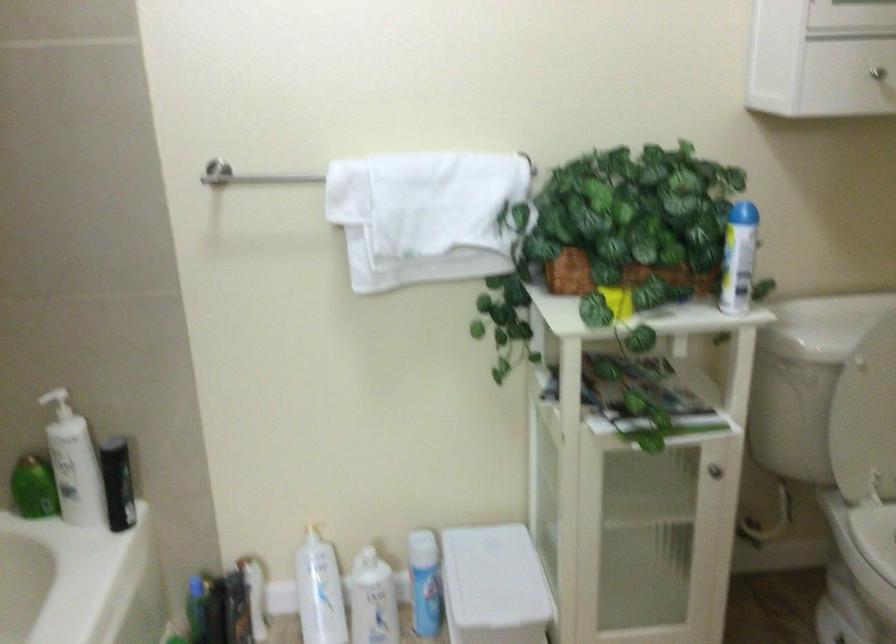
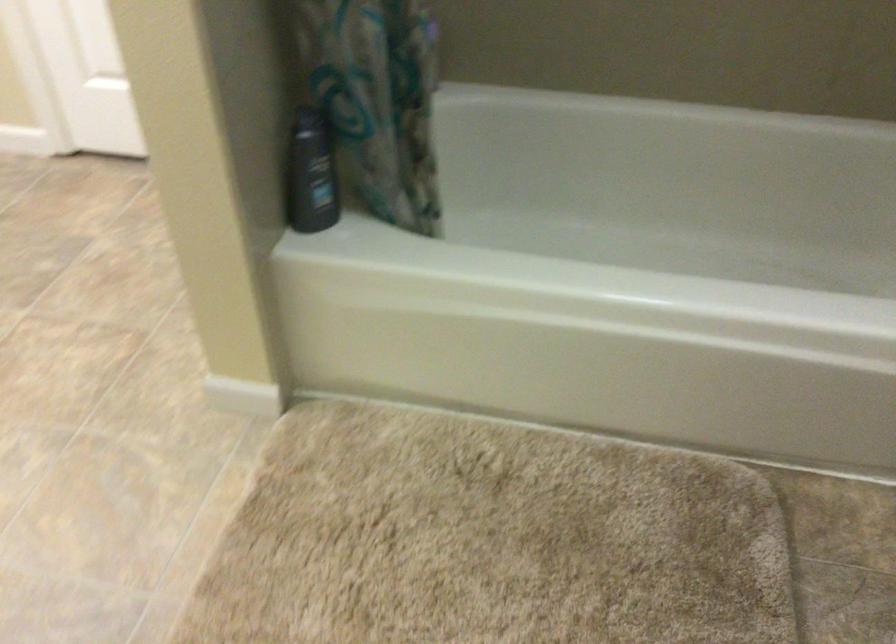
Based on the continuous images, in which direction is the camera rotating?

The camera rotated toward left-down.